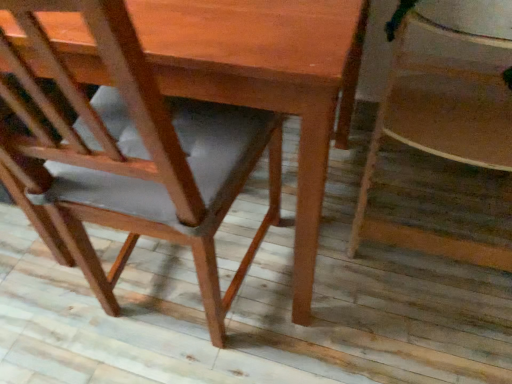
Question: From a real-world perspective, is wooden chair at lower right, which is the 1th chair from right to left, above or below matte brown chair at center, the 1th chair when ordered from left to right?

Choices:
 (A) below
 (B) above

Answer: (A)

Question: Based on their sizes in the image, would you say wooden chair at lower right, which is the 1th chair from right to left, is bigger or smaller than matte brown chair at center, positioned as the 2th chair in right-to-left order?

Choices:
 (A) small
 (B) big

Answer: (A)

Question: Is wooden chair at lower right, the second chair from the left, inside or outside of matte brown chair at center, the 1th chair when ordered from left to right?

Choices:
 (A) outside
 (B) inside

Answer: (A)

Question: Looking at the image, does matte brown chair at center, positioned as the 2th chair in right-to-left order, seem bigger or smaller compared to wooden chair at lower right, which is the 1th chair from right to left?

Choices:
 (A) big
 (B) small

Answer: (A)

Question: In the image, is matte brown chair at center, positioned as the 2th chair in right-to-left order, on the left side or the right side of wooden chair at lower right, which is the 1th chair from right to left?

Choices:
 (A) left
 (B) right

Answer: (A)

Question: From the image's perspective, is matte brown chair at center, positioned as the 2th chair in right-to-left order, above or below wooden chair at lower right, which is the 1th chair from right to left?

Choices:
 (A) below
 (B) above

Answer: (A)

Question: Relative to wooden chair at lower right, which is the 1th chair from right to left, is matte brown chair at center, positioned as the 2th chair in right-to-left order, in front or behind?

Choices:
 (A) behind
 (B) front

Answer: (B)